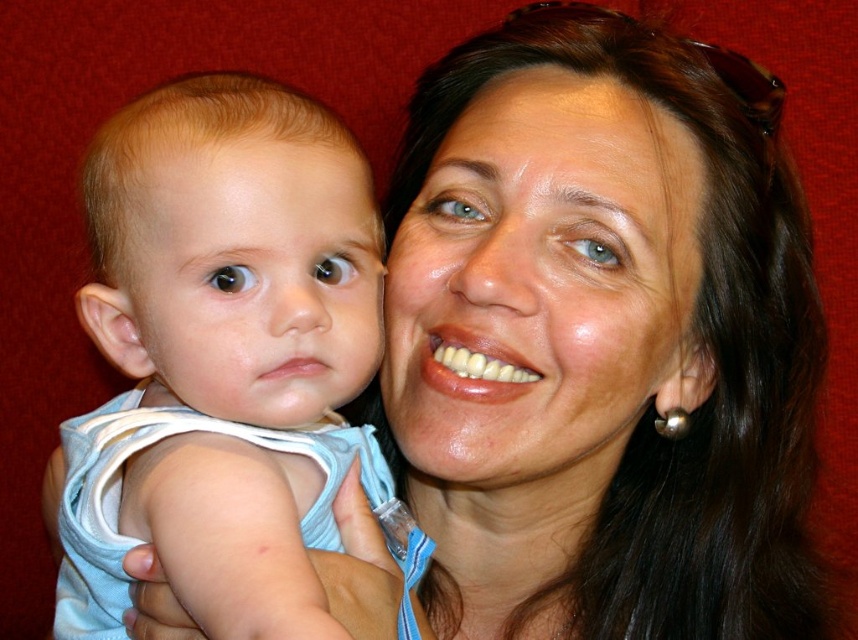
You are standing 60 centimeters away from the point at coordinates point (523, 92). Can you reach it without moving your feet?

The point at coordinates point (523, 92) is 58.28 centimeters away from you, so yes, you can reach it without moving your feet since it is within the 60 centimeter range.

You are a photographer adjusting the focus on your camera. You notice two points in the image at coordinates point [327,113] and point [312,307]. Which point is closer to you, the photographer?

Point [327,113] is further to the viewer than point [312,307], so the point closer to you is point [312,307].

You are a photographer adjusting the lighting for a portrait. You need to ensure that the light blue fabric baby at left and the smooth skin face at center are well lit. Given their distance apart, will you need to adjust the lighting setup to accommodate both subjects?

The light blue fabric baby at left is 4.82 inches from the smooth skin face at center. Since the distance between them is minimal, you can maintain consistent lighting without needing major adjustments to ensure both are well lit.